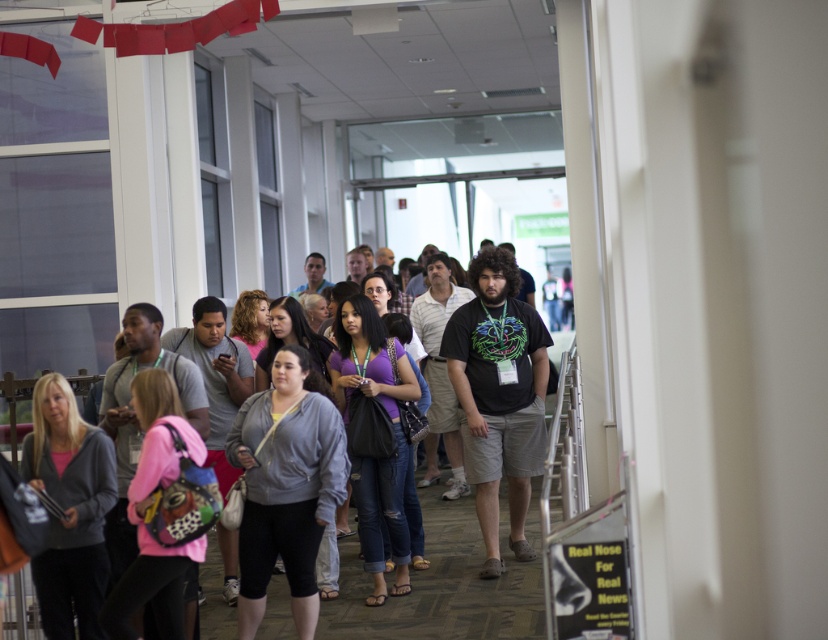
Question: Does gray hoodie at center appear on the left side of gray fleece jacket at center?

Choices:
 (A) no
 (B) yes

Answer: (A)

Question: Among these objects, which one is farthest from the camera?

Choices:
 (A) gray hoodie at center
 (B) gray fleece jacket at center

Answer: (A)

Question: Which point is closer to the camera taking this photo?

Choices:
 (A) (302, 387)
 (B) (273, 582)

Answer: (A)

Question: Is gray hoodie at center below gray fleece jacket at center?

Choices:
 (A) yes
 (B) no

Answer: (A)

Question: Which point is farther to the camera?

Choices:
 (A) gray hoodie at center
 (B) gray fleece jacket at center

Answer: (A)

Question: Is gray hoodie at center closer to the viewer compared to gray fleece jacket at center?

Choices:
 (A) yes
 (B) no

Answer: (B)